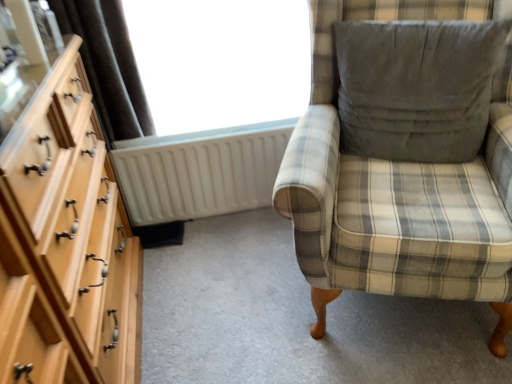
Question: Does transparent glass window at upper center have a larger size compared to light wood dresser at left?

Choices:
 (A) yes
 (B) no

Answer: (B)

Question: Is transparent glass window at upper center in front of light wood dresser at left?

Choices:
 (A) yes
 (B) no

Answer: (B)

Question: Is transparent glass window at upper center next to light wood dresser at left and touching it?

Choices:
 (A) yes
 (B) no

Answer: (B)

Question: From the image's perspective, is transparent glass window at upper center below light wood dresser at left?

Choices:
 (A) yes
 (B) no

Answer: (B)

Question: Is transparent glass window at upper center wider than light wood dresser at left?

Choices:
 (A) no
 (B) yes

Answer: (A)

Question: Can you confirm if transparent glass window at upper center is thinner than light wood dresser at left?

Choices:
 (A) yes
 (B) no

Answer: (A)

Question: Does white plastic radiator at center have a greater width compared to gray suede pillow at upper right?

Choices:
 (A) yes
 (B) no

Answer: (B)

Question: Can you confirm if white plastic radiator at center is positioned to the left of gray suede pillow at upper right?

Choices:
 (A) yes
 (B) no

Answer: (A)

Question: From a real-world perspective, is white plastic radiator at center positioned over gray suede pillow at upper right based on gravity?

Choices:
 (A) yes
 (B) no

Answer: (B)

Question: Considering the relative sizes of white plastic radiator at center and gray suede pillow at upper right in the image provided, is white plastic radiator at center smaller than gray suede pillow at upper right?

Choices:
 (A) yes
 (B) no

Answer: (A)

Question: Considering the relative sizes of white plastic radiator at center and gray suede pillow at upper right in the image provided, is white plastic radiator at center bigger than gray suede pillow at upper right?

Choices:
 (A) no
 (B) yes

Answer: (A)

Question: Is gray suede pillow at upper right at the back of white plastic radiator at center?

Choices:
 (A) yes
 (B) no

Answer: (B)

Question: Is light wood dresser at left not inside gray suede pillow at upper right?

Choices:
 (A) no
 (B) yes

Answer: (B)